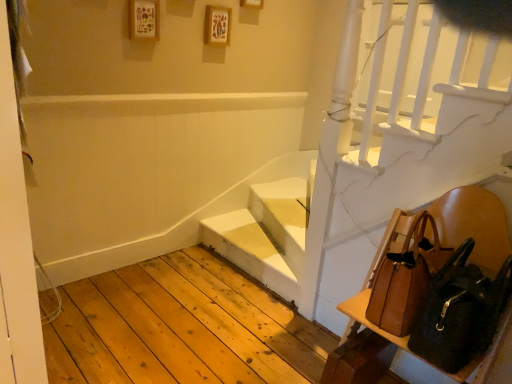
Question: Is brown leather shoulder bag at lower right, the first shoulder bag viewed from the front, situated inside brown leather chair at lower right or outside?

Choices:
 (A) inside
 (B) outside

Answer: (A)

Question: In terms of width, does brown leather shoulder bag at lower right, acting as the 2th shoulder bag starting from the back, look wider or thinner when compared to brown leather chair at lower right?

Choices:
 (A) wide
 (B) thin

Answer: (B)

Question: Which object is positioned farthest from the brown leather shoulder bag at lower right, the first shoulder bag viewed from the front?

Choices:
 (A) white matte stairs at center
 (B) brown leather shoulder bag at right, which ranks as the 1th shoulder bag in back-to-front order
 (C) brown leather chair at lower right

Answer: (A)

Question: Estimate the real-world distances between objects in this image. Which object is farther from the brown leather shoulder bag at right, which ranks as the 1th shoulder bag in back-to-front order?

Choices:
 (A) white matte stairs at center
 (B) brown leather shoulder bag at lower right, acting as the 2th shoulder bag starting from the back
 (C) brown leather chair at lower right

Answer: (A)